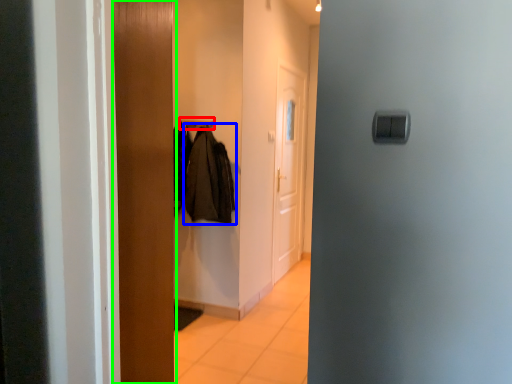
Question: Which object is positioned closest to hanger (highlighted by a red box)? Select from clothing (highlighted by a blue box) and door (highlighted by a green box).

Choices:
 (A) clothing
 (B) door

Answer: (A)